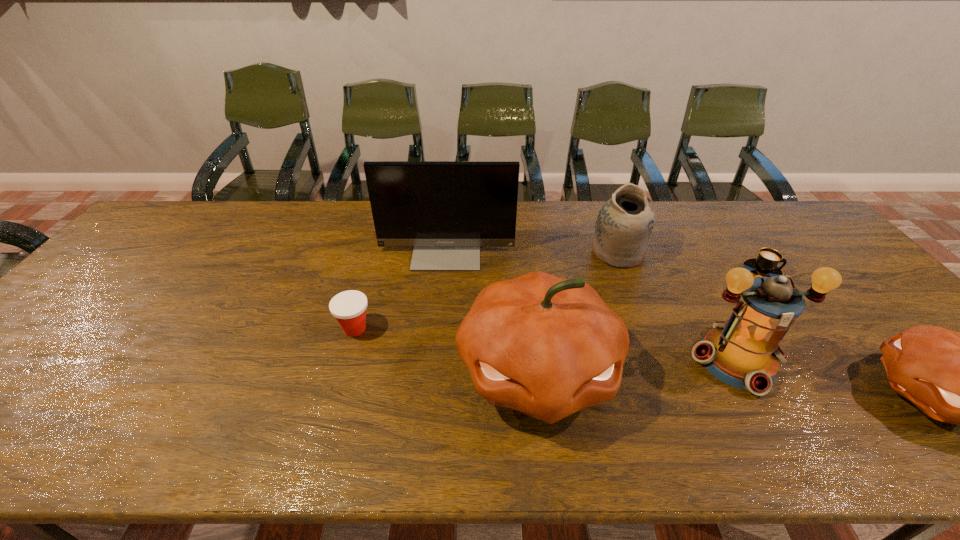
You are a GUI agent. You are given a task and a screenshot of the screen. Output one action in this format:
    pyautogui.click(x=<x>, y=<y>)
    Task: Click on the taller pumpkin
    This screenshot has height=540, width=960.
    Given the screenshot: What is the action you would take?
    pyautogui.click(x=548, y=347)

This screenshot has width=960, height=540. Identify the location of computer monitor. click(446, 210).

At what (x,y) coordinates should I click in order to perform the action: click on cappuccino. Please return your answer as a coordinate pair (x, y). The image size is (960, 540). Looking at the image, I should click on (765, 264).

This screenshot has width=960, height=540. I want to click on pottery, so click(x=624, y=225).

The width and height of the screenshot is (960, 540). In order to click on lantern in this screenshot , I will do `click(743, 352)`.

I want to click on the sixth tallest object, so click(x=349, y=307).

The height and width of the screenshot is (540, 960). I want to click on free space located on the screen of the computer monitor, so click(x=441, y=313).

The width and height of the screenshot is (960, 540). I want to click on vacant region located on the front of the cappuccino, so click(809, 335).

Identify the location of vacant space located on the back of the pottery. (609, 228).

Locate an element on the screen. This screenshot has height=540, width=960. vacant point located 0.170m on the front of the Dixie cup is located at coordinates (334, 402).